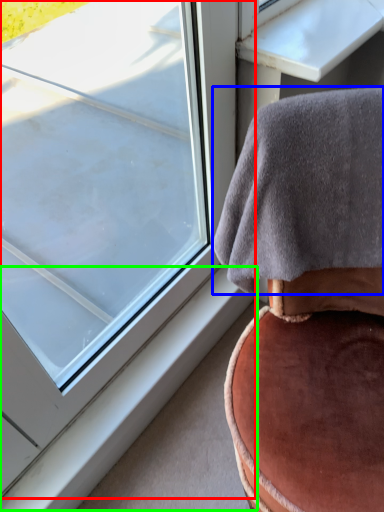
Question: Which object is the farthest from window (highlighted by a red box)? Choose among these: blanket (highlighted by a blue box) or window sill (highlighted by a green box).

Choices:
 (A) blanket
 (B) window sill

Answer: (A)